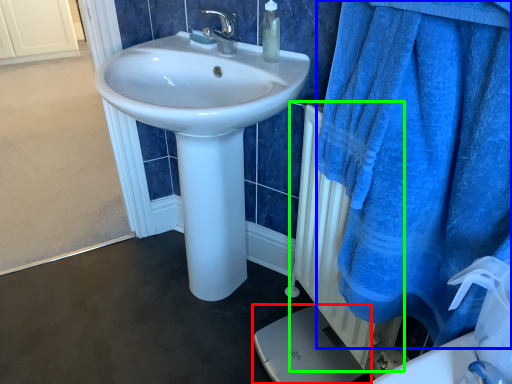
Question: Which object is the closest to the porcelain (highlighted by a red box)? Choose among these: bath towel (highlighted by a blue box) or radiator (highlighted by a green box).

Choices:
 (A) bath towel
 (B) radiator

Answer: (B)